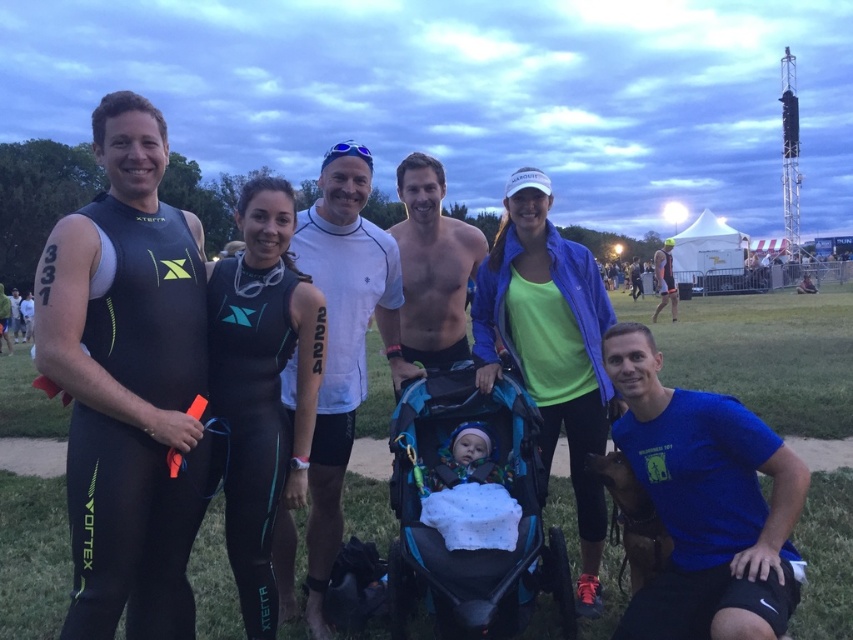
Can you confirm if teal fabric stroller at center is bigger than neon green fabric at center?

Correct, teal fabric stroller at center is larger in size than neon green fabric at center.

Where is `teal fabric stroller at center`? The height and width of the screenshot is (640, 853). teal fabric stroller at center is located at coordinates (479, 483).

Which is behind, point (426, 392) or point (502, 253)?

The point (502, 253) is behind.

At what (x,y) coordinates should I click in order to perform the action: click on teal fabric stroller at center. Please return your answer as a coordinate pair (x, y). The width and height of the screenshot is (853, 640). Looking at the image, I should click on (479, 483).

Is point (117, 536) behind point (409, 333)?

No, (117, 536) is closer to viewer.

Can you confirm if matte black wetsuit at left is smaller than shiny black skin at center?

Indeed, matte black wetsuit at left has a smaller size compared to shiny black skin at center.

Find the location of `matte black wetsuit at left`. matte black wetsuit at left is located at coordinates (126, 381).

The image size is (853, 640). What are the coordinates of `matte black wetsuit at left` in the screenshot? It's located at (126, 381).

Can you confirm if matte black wetsuit at left is wider than white matte shirt at center?

Correct, the width of matte black wetsuit at left exceeds that of white matte shirt at center.

Is matte black wetsuit at left taller than white matte shirt at center?

Yes, matte black wetsuit at left is taller than white matte shirt at center.

Is point (38, 321) farther from viewer compared to point (317, 460)?

No, it is in front of (317, 460).

Where is `matte black wetsuit at left`? This screenshot has height=640, width=853. matte black wetsuit at left is located at coordinates (126, 381).